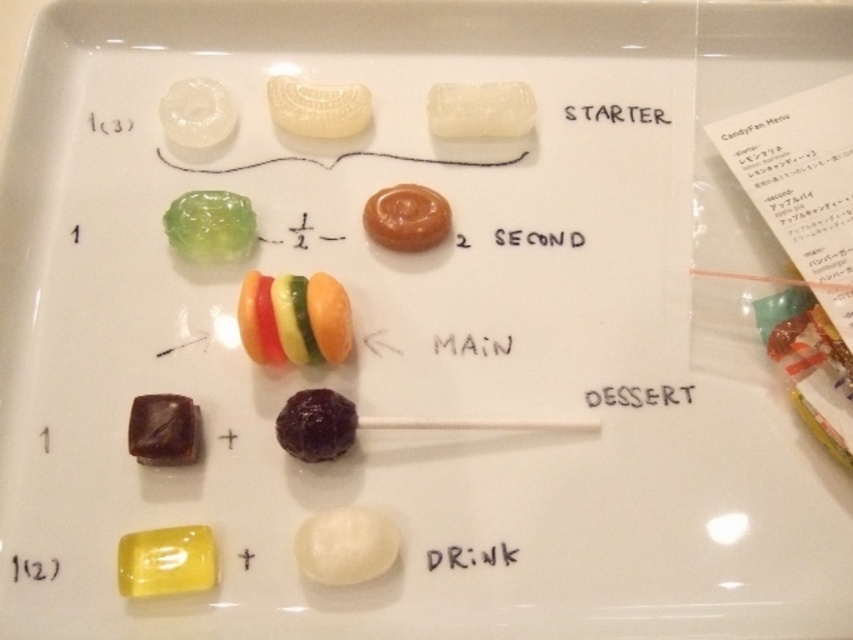
Which is behind, point (252, 209) or point (434, 227)?

Positioned behind is point (252, 209).

Is translucent green jelly at upper left wider than matte caramel candy at center?

In fact, translucent green jelly at upper left might be narrower than matte caramel candy at center.

This screenshot has height=640, width=853. What do you see at coordinates (210, 225) in the screenshot? I see `translucent green jelly at upper left` at bounding box center [210, 225].

Find the location of a particular element. translucent green jelly at upper left is located at coordinates (210, 225).

Between matte caramel candy at center and shiny dark purple lollipop at center, which one has less height?

shiny dark purple lollipop at center

Who is more forward, (430,241) or (346,403)?

Point (346,403)

Locate an element on the screen. matte caramel candy at center is located at coordinates (405, 218).

What are the coordinates of `matte caramel candy at center` in the screenshot? It's located at (405, 218).

Is white glossy candy at upper center further to the viewer compared to black paper at upper center?

No, white glossy candy at upper center is in front of black paper at upper center.

Between white glossy candy at upper center and black paper at upper center, which one appears on the left side from the viewer's perspective?

From the viewer's perspective, white glossy candy at upper center appears more on the left side.

Between point (485, 134) and point (639, 120), which one is positioned in front?

Positioned in front is point (639, 120).

Find the location of a particular element. The image size is (853, 640). white glossy candy at upper center is located at coordinates (480, 109).